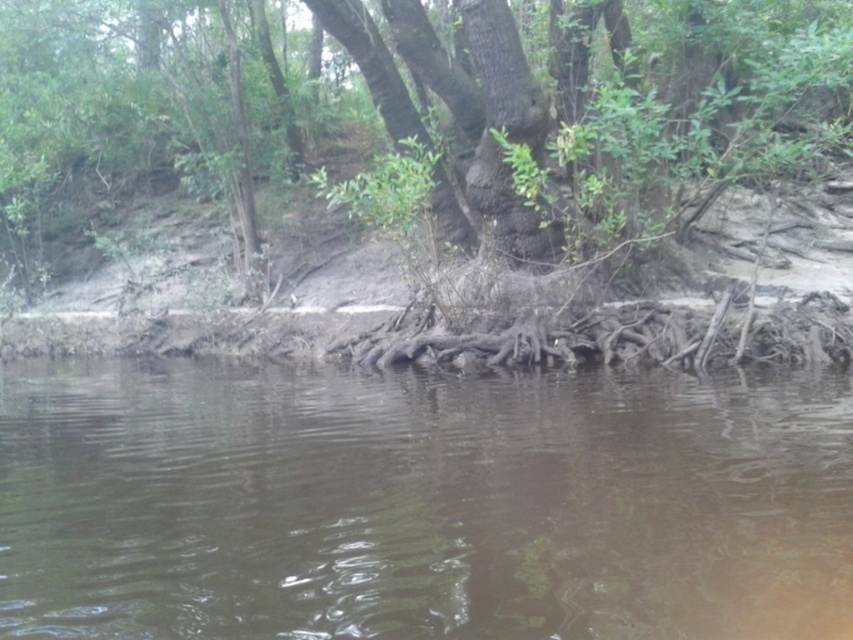
Is point (556, 404) behind point (735, 113)?

That is False.

Between point (65, 634) and point (103, 97), which one is positioned in front?

Point (65, 634) is in front.

In order to click on brown muddy water at center in this screenshot , I will do `click(421, 502)`.